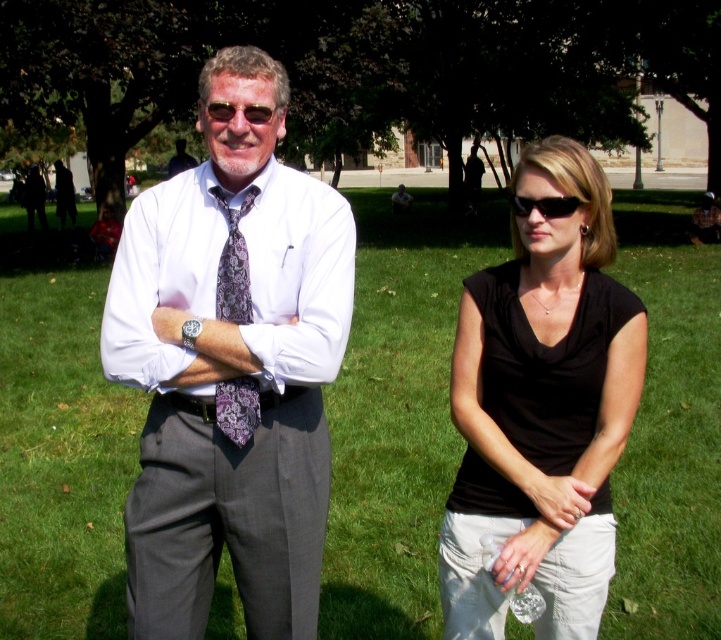
You are a photographer trying to capture a photo of the green grass at center and the white cotton dress shirt at center. Which object is positioned higher in the image?

The green grass at center is positioned higher than the white cotton dress shirt at center according to the description.

You are a photographer standing at the camera position. You want to take a photo of the two people in the scene. Since the green grass at center is in the way, can you step back to avoid it?

The distance between the green grass at center and the camera is 3.71 meters. Since the grass is at the center, stepping back might not avoid it. You should adjust your angle instead.